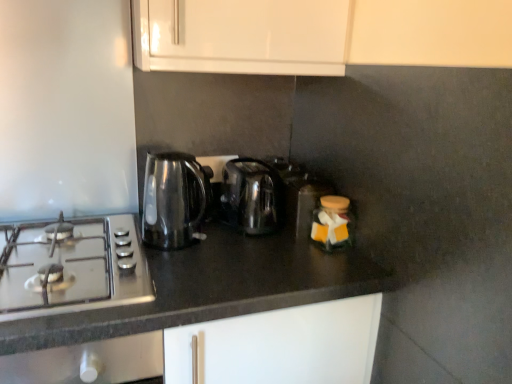
Find the location of a particular element. This screenshot has height=384, width=512. vacant space in front of transparent glass kettle at left, acting as the 1th kitchen appliance starting from the left is located at coordinates (187, 273).